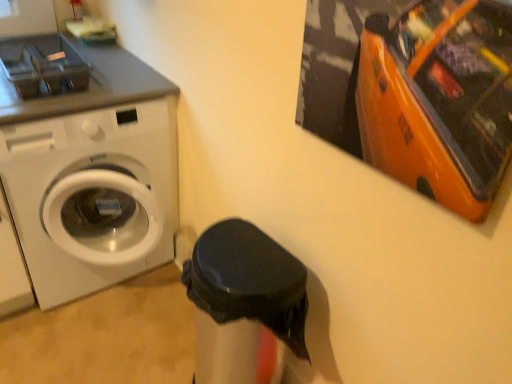
Question: From a real-world perspective, relative to white glossy washing machine at left, is black matte trash can at center vertically above or below?

Choices:
 (A) above
 (B) below

Answer: (B)

Question: Is black matte trash can at center wider or thinner than white glossy washing machine at left?

Choices:
 (A) wide
 (B) thin

Answer: (B)

Question: Relative to white glossy washing machine at left, is black matte trash can at center in front or behind?

Choices:
 (A) behind
 (B) front

Answer: (B)

Question: Choose the correct answer: Is white glossy washing machine at left inside black matte trash can at center or outside it?

Choices:
 (A) outside
 (B) inside

Answer: (A)

Question: From the image's perspective, relative to black matte trash can at center, is white glossy washing machine at left above or below?

Choices:
 (A) above
 (B) below

Answer: (A)

Question: Is white glossy washing machine at left in front of or behind black matte trash can at center in the image?

Choices:
 (A) front
 (B) behind

Answer: (B)

Question: Does point (120, 251) appear closer or farther from the camera than point (288, 314)?

Choices:
 (A) closer
 (B) farther

Answer: (B)